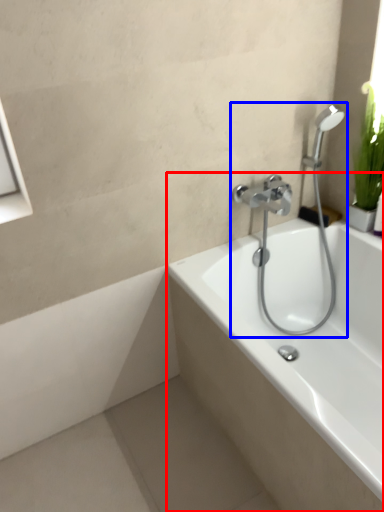
Question: Which object is closer to the camera taking this photo, bathtub (highlighted by a red box) or plumbing fixture (highlighted by a blue box)?

Choices:
 (A) bathtub
 (B) plumbing fixture

Answer: (A)